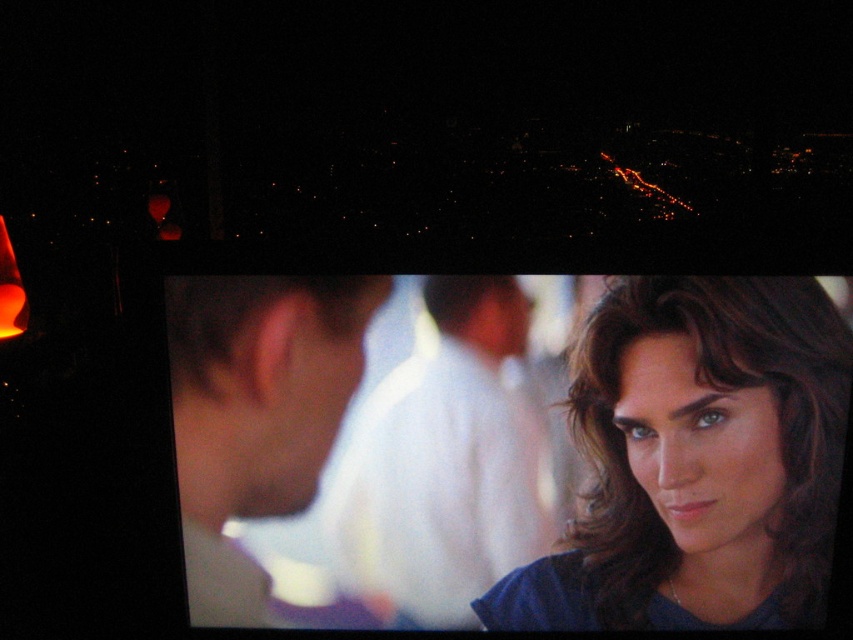
You are an AI analyzing an image. The image has a nighttime cityscape in the upper part and a close movie scene in the lower part. There is a point at coordinates (697, 461). Based on the image, what object is this point located on?

The point is on the matte blue shirt at center.

You are standing in front of a large screen displaying the image described. You want to reach out and touch the white cotton shirt at center. Considering the distance, can you do this without moving closer?

The white cotton shirt at center is 4.61 feet away from viewer, so yes, you can touch it without moving closer as the distance is within reach.

You are an actor in a movie scene and need to locate your matte blue shirt at center. According to the scene coordinates, where should you look?

You should look at point (697, 461) to find the matte blue shirt at center.